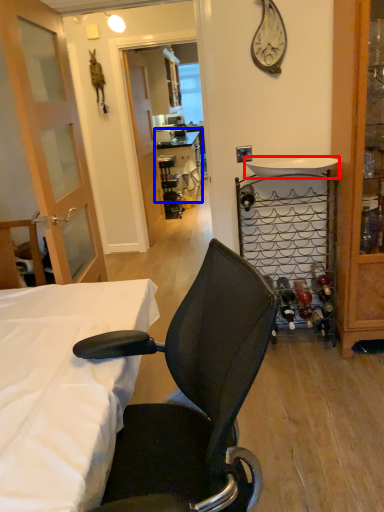
Question: Which object appears farthest to the camera in this image, sink (highlighted by a red box) or table (highlighted by a blue box)?

Choices:
 (A) sink
 (B) table

Answer: (B)